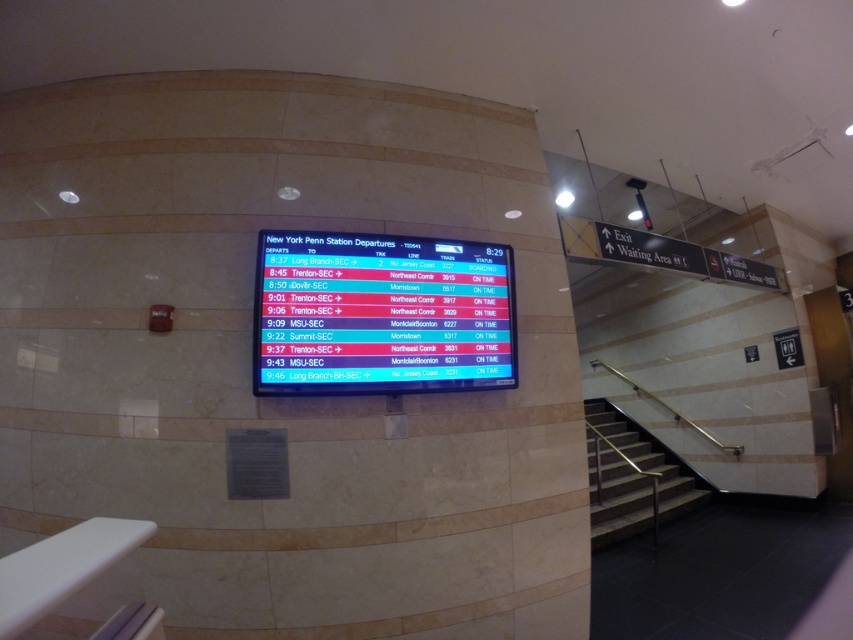
Can you confirm if backlit lcd display at center is positioned to the left of metallic silver handrail at lower right?

Correct, you'll find backlit lcd display at center to the left of metallic silver handrail at lower right.

Is point (326, 337) positioned after point (640, 449)?

No, it is not.

Is point (276, 234) more distant than point (589, 460)?

That is False.

You are a GUI agent. You are given a task and a screenshot of the screen. Output one action in this format:
    pyautogui.click(x=<x>, y=<y>)
    Task: Click on the backlit lcd display at center
    The image size is (853, 640).
    Given the screenshot: What is the action you would take?
    pyautogui.click(x=381, y=314)